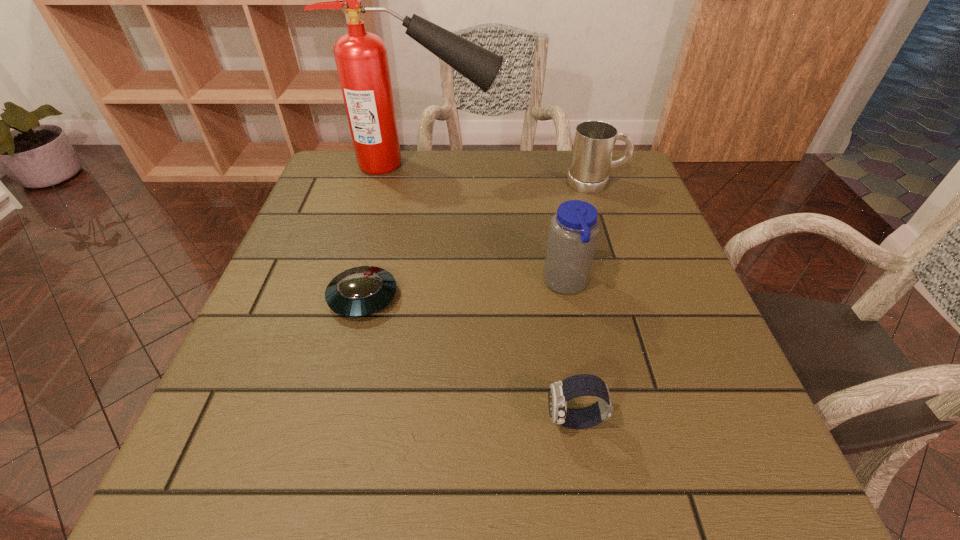
This screenshot has width=960, height=540. In order to click on object that is at the far left corner in this screenshot , I will do `click(361, 58)`.

Where is `object located in the far right corner section of the desktop`? object located in the far right corner section of the desktop is located at coordinates (594, 141).

Where is `vacant space at the far edge`? The height and width of the screenshot is (540, 960). vacant space at the far edge is located at coordinates (481, 152).

Image resolution: width=960 pixels, height=540 pixels. In the image, there is a desktop. What are the coordinates of `vacant space at the left edge` in the screenshot? It's located at (269, 357).

Find the location of a particular element. This screenshot has width=960, height=540. free space at the right edge of the desktop is located at coordinates (597, 207).

I want to click on vacant region at the far left corner of the desktop, so click(370, 196).

Find the location of a particular element. The width and height of the screenshot is (960, 540). free space at the near left corner of the desktop is located at coordinates (281, 456).

You are a GUI agent. You are given a task and a screenshot of the screen. Output one action in this format:
    pyautogui.click(x=<x>, y=<y>)
    Task: Click on the free space at the far right corner
    
    Given the screenshot: What is the action you would take?
    pyautogui.click(x=642, y=181)

At what (x,y) coordinates should I click in order to perform the action: click on free point between the tallest object and the rightmost object. Please return your answer as a coordinate pair (x, y). This screenshot has height=540, width=960. Looking at the image, I should click on (508, 173).

This screenshot has width=960, height=540. What are the coordinates of `vacant area that lies between the second tallest object and the shortest object` in the screenshot? It's located at (465, 291).